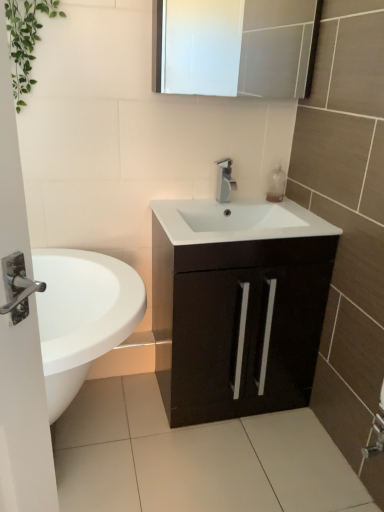
Question: Does silver metallic faucet at center lie behind matte black cabinet at center?

Choices:
 (A) yes
 (B) no

Answer: (A)

Question: Is silver metallic faucet at center far away from matte black cabinet at center?

Choices:
 (A) no
 (B) yes

Answer: (A)

Question: Does silver metallic faucet at center have a smaller size compared to matte black cabinet at center?

Choices:
 (A) yes
 (B) no

Answer: (A)

Question: Considering the relative positions of silver metallic faucet at center and matte black cabinet at center in the image provided, is silver metallic faucet at center to the right of matte black cabinet at center from the viewer's perspective?

Choices:
 (A) no
 (B) yes

Answer: (A)

Question: Does silver metallic faucet at center contain matte black cabinet at center?

Choices:
 (A) yes
 (B) no

Answer: (B)

Question: From the image's perspective, is silver metallic faucet at center above matte black cabinet at center?

Choices:
 (A) no
 (B) yes

Answer: (B)

Question: Could you tell me if silver metallic faucet at center is facing white glossy medicine cabinet at upper center?

Choices:
 (A) yes
 (B) no

Answer: (B)

Question: Would you say silver metallic faucet at center contains white glossy medicine cabinet at upper center?

Choices:
 (A) yes
 (B) no

Answer: (B)

Question: Is silver metallic faucet at center touching white glossy medicine cabinet at upper center?

Choices:
 (A) yes
 (B) no

Answer: (B)

Question: Is silver metallic faucet at center oriented away from white glossy medicine cabinet at upper center?

Choices:
 (A) yes
 (B) no

Answer: (B)

Question: Can you confirm if silver metallic faucet at center is thinner than white glossy medicine cabinet at upper center?

Choices:
 (A) no
 (B) yes

Answer: (B)

Question: Considering the relative positions of silver metallic faucet at center and white glossy medicine cabinet at upper center in the image provided, is silver metallic faucet at center to the right of white glossy medicine cabinet at upper center from the viewer's perspective?

Choices:
 (A) yes
 (B) no

Answer: (B)

Question: Is green leafy plant at upper left next to silver metallic faucet at center?

Choices:
 (A) yes
 (B) no

Answer: (B)